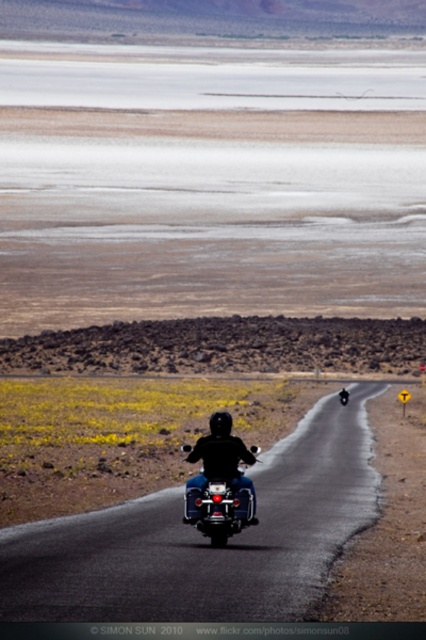
Who is more forward, (305, 438) or (207, 492)?

Point (207, 492)

Is point (348, 472) positioned before point (210, 520)?

No, (348, 472) is further to viewer.

Between point (273, 515) and point (218, 467), which one is positioned in front?

Point (218, 467) is more forward.

At what (x,y) coordinates should I click in order to perform the action: click on black rubber motorcycle at center. Please return your answer as a coordinate pair (x, y). Looking at the image, I should click on (206, 540).